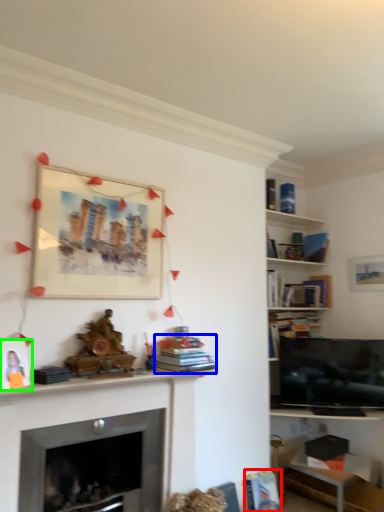
Question: Considering the real-world distances, which object is closest to book (highlighted by a red box)? book (highlighted by a blue box) or picture frame (highlighted by a green box).

Choices:
 (A) book
 (B) picture frame

Answer: (A)